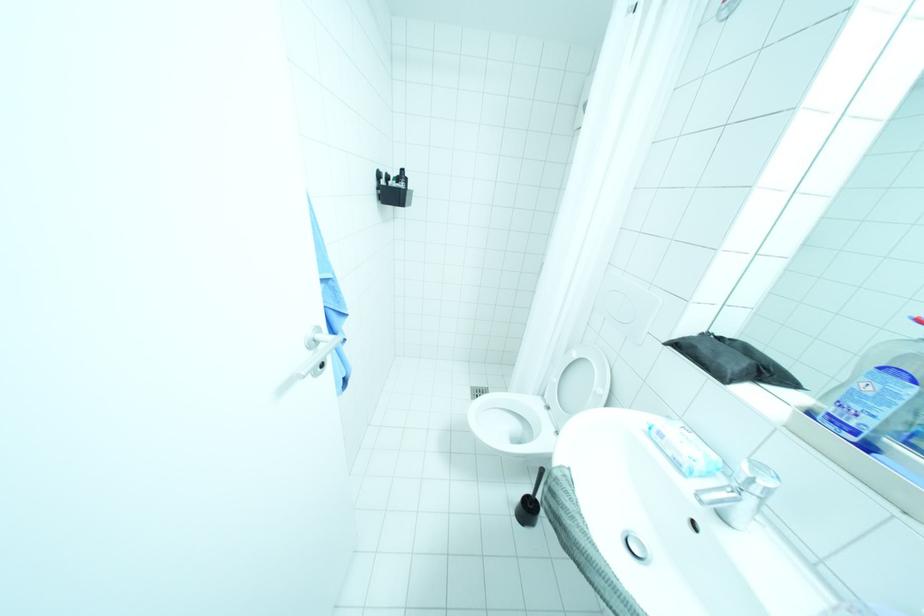
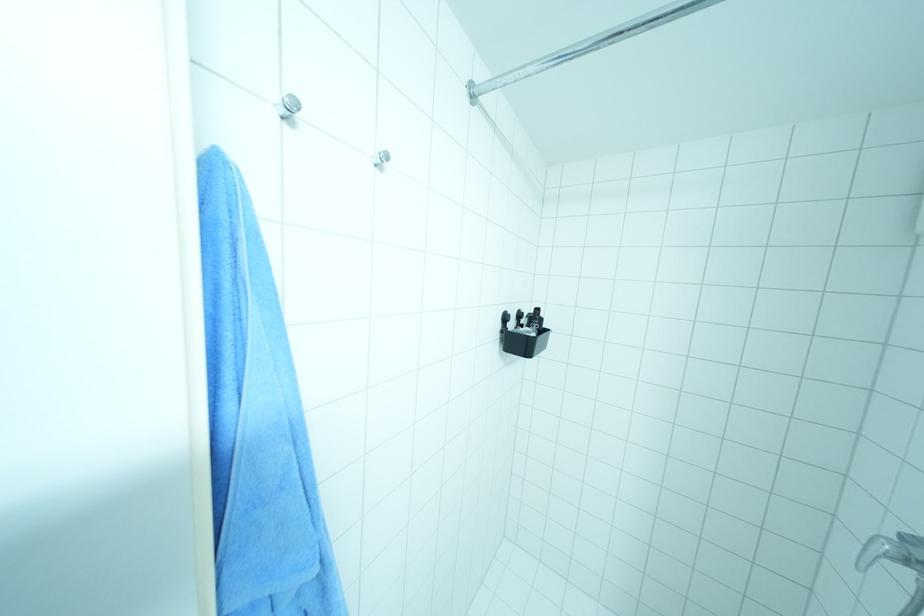
Based on the continuous images, in which direction is the camera rotating?

The camera's rotation is toward left-up.